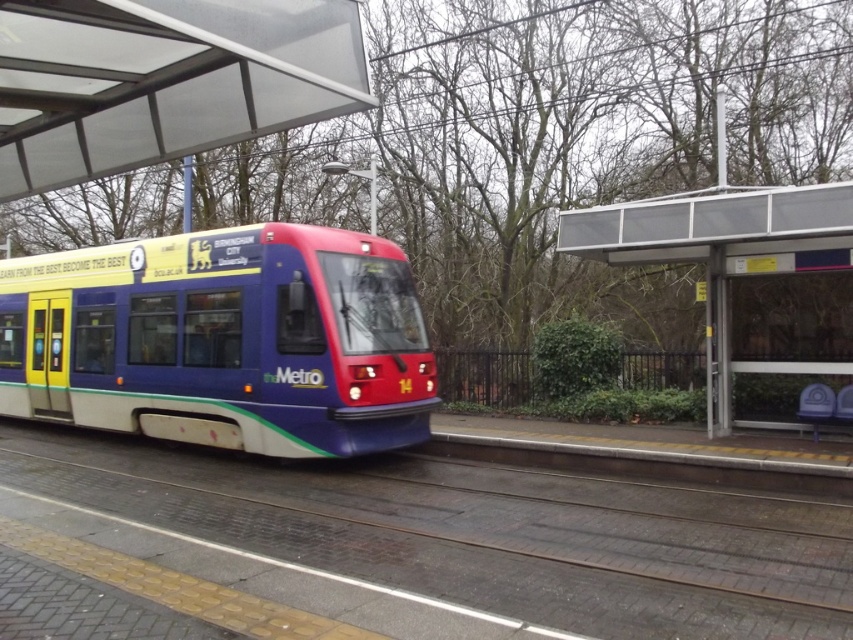
Question: Does metallic track at center have a larger size compared to matte blue train at center?

Choices:
 (A) yes
 (B) no

Answer: (B)

Question: Which of the following is the farthest from the observer?

Choices:
 (A) (181, 289)
 (B) (196, 509)

Answer: (A)

Question: Can you confirm if metallic track at center is positioned above matte blue train at center?

Choices:
 (A) no
 (B) yes

Answer: (A)

Question: Can you confirm if metallic track at center is positioned to the right of matte blue train at center?

Choices:
 (A) yes
 (B) no

Answer: (A)